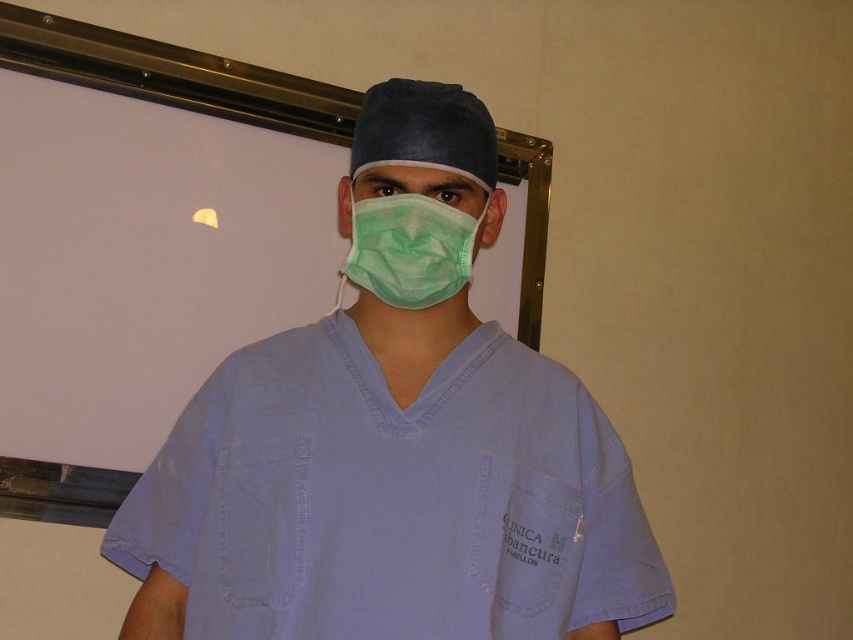
Question: Which of the following is the farthest from the observer?

Choices:
 (A) (419, 285)
 (B) (459, 424)

Answer: (B)

Question: Which point is farther to the camera?

Choices:
 (A) (523, 506)
 (B) (363, 221)

Answer: (A)

Question: Which point is closer to the camera?

Choices:
 (A) green matte mask at center
 (B) light blue scrubs at center

Answer: (B)

Question: Is light blue scrubs at center positioned in front of green matte mask at center?

Choices:
 (A) yes
 (B) no

Answer: (A)

Question: Is light blue scrubs at center further to camera compared to green matte mask at center?

Choices:
 (A) yes
 (B) no

Answer: (B)

Question: Does light blue scrubs at center appear on the left side of green matte mask at center?

Choices:
 (A) yes
 (B) no

Answer: (A)